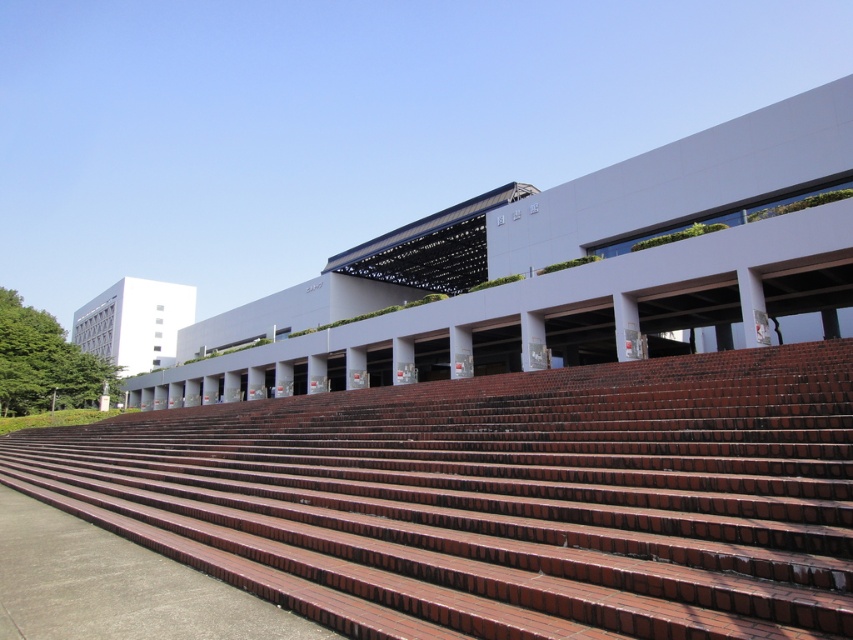
You are standing at the entrance of the modern architectural structure and want to reach the upper level. The brown brick stairs at center are your only path. What is the exact coordinate of the stairs to navigate towards?

The brown brick stairs at center are located at coordinate point (500, 499), so you should navigate towards that exact position to reach the upper level.

You are standing at the base of the brown brick stairs at center and want to reach the brown brick amphitheater at center. Which direction should you move to get closer to the amphitheater?

Since the brown brick stairs at center are closer to the viewer than the brown brick amphitheater at center, you should move forward away from the stairs towards the amphitheater to get closer to it.

From the picture: You are an architect designing a new public space and want to incorporate both the brown brick stairs at center and the brown brick amphitheater at center. Based on their sizes, which one should be placed higher up in the design to maintain visual balance?

The brown brick amphitheater at center should be placed higher up because it is taller than the brown brick stairs at center, creating a balanced visual composition.